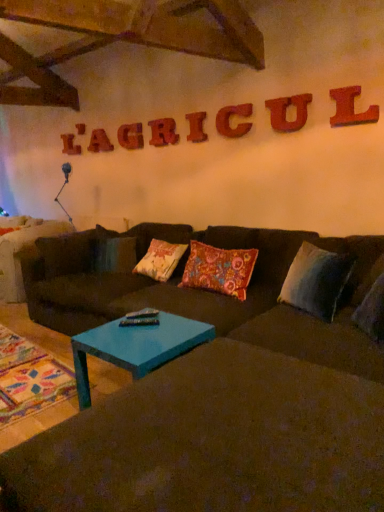
What is the approximate width of gray fabric pillow at right, which appears as the 2th pillow when viewed from the left?

gray fabric pillow at right, which appears as the 2th pillow when viewed from the left, is 9.56 inches wide.

Describe the element at coordinates (136, 347) in the screenshot. I see `teal glossy coffee table at center` at that location.

You are a GUI agent. You are given a task and a screenshot of the screen. Output one action in this format:
    pyautogui.click(x=<x>, y=<y>)
    Task: Click on the dark brown fabric couch at center
    This screenshot has width=384, height=512.
    Given the screenshot: What is the action you would take?
    pyautogui.click(x=212, y=390)

What are the coordinates of `gray fabric pillow at right, which appears as the 2th pillow when viewed from the left` in the screenshot? It's located at (316, 280).

From the image's perspective, is floral-patterned fabric pillow at center, which appears as the second pillow when viewed from the right, located above gray fabric pillow at right, which appears as the 2th pillow when viewed from the left?

Indeed, from the image's perspective, floral-patterned fabric pillow at center, which appears as the second pillow when viewed from the right, is shown above gray fabric pillow at right, which appears as the 2th pillow when viewed from the left.

From a real-world perspective, is floral-patterned fabric pillow at center, the 1th pillow when ordered from left to right, physically above gray fabric pillow at right, the first pillow when ordered from right to left?

Correct, in the physical world, floral-patterned fabric pillow at center, the 1th pillow when ordered from left to right, is higher than gray fabric pillow at right, the first pillow when ordered from right to left.

Is there a large distance between floral-patterned fabric pillow at center, the 1th pillow when ordered from left to right, and gray fabric pillow at right, which appears as the 2th pillow when viewed from the left?

Actually, floral-patterned fabric pillow at center, the 1th pillow when ordered from left to right, and gray fabric pillow at right, which appears as the 2th pillow when viewed from the left, are a little close together.

From the picture: Which object is further away from the camera taking this photo, floral-patterned fabric pillow at center, the 1th pillow when ordered from left to right, or gray fabric pillow at right, the first pillow when ordered from right to left?

floral-patterned fabric pillow at center, the 1th pillow when ordered from left to right, is more distant.

From the image's perspective, is gray fabric pillow at right, the first pillow when ordered from right to left, on top of floral-patterned fabric pillow at center, which appears as the second pillow when viewed from the right?

No, from the image's perspective, gray fabric pillow at right, the first pillow when ordered from right to left, is not on top of floral-patterned fabric pillow at center, which appears as the second pillow when viewed from the right.

Is point (288, 282) positioned before point (232, 258)?

Yes.

Does gray fabric pillow at right, which appears as the 2th pillow when viewed from the left, have a lesser height compared to floral-patterned fabric pillow at center, the 1th pillow when ordered from left to right?

Correct, gray fabric pillow at right, which appears as the 2th pillow when viewed from the left, is not as tall as floral-patterned fabric pillow at center, the 1th pillow when ordered from left to right.

Is dark brown fabric couch at center located within floral-patterned fabric pillow at center, which appears as the second pillow when viewed from the right?

No, dark brown fabric couch at center is not inside floral-patterned fabric pillow at center, which appears as the second pillow when viewed from the right.

Who is more distant, floral-patterned fabric pillow at center, the 1th pillow when ordered from left to right, or dark brown fabric couch at center?

floral-patterned fabric pillow at center, the 1th pillow when ordered from left to right, is behind.

Find the location of a particular element. This screenshot has width=384, height=512. studio couch in front of the floral-patterned fabric pillow at center, which appears as the second pillow when viewed from the right is located at coordinates (212, 390).

Is floral-patterned fabric pillow at center, the 1th pillow when ordered from left to right, thinner than dark brown fabric couch at center?

Indeed, floral-patterned fabric pillow at center, the 1th pillow when ordered from left to right, has a lesser width compared to dark brown fabric couch at center.

Which of these two, floral-patterned fabric pillow at center, the 1th pillow when ordered from left to right, or teal glossy coffee table at center, is smaller?

With smaller size is floral-patterned fabric pillow at center, the 1th pillow when ordered from left to right.

Between point (220, 269) and point (172, 317), which one is positioned behind?

The point (220, 269) is behind.

This screenshot has height=512, width=384. I want to click on coffee table below the floral-patterned fabric pillow at center, the 1th pillow when ordered from left to right (from the image's perspective), so click(x=136, y=347).

Does floral-patterned fabric pillow at center, which appears as the second pillow when viewed from the right, lie in front of teal glossy coffee table at center?

That is False.

Is floral-patterned fabric pillow at center, which appears as the second pillow when viewed from the right, at the back of teal glossy coffee table at center?

Yes, teal glossy coffee table at center is facing away from floral-patterned fabric pillow at center, which appears as the second pillow when viewed from the right.

Is teal glossy coffee table at center directly adjacent to floral-patterned fabric pillow at center, which appears as the second pillow when viewed from the right?

No.

Is teal glossy coffee table at center inside the boundaries of floral-patterned fabric pillow at center, the 1th pillow when ordered from left to right, or outside?

The correct answer is: outside.

From a real-world perspective, is teal glossy coffee table at center above or below floral-patterned fabric pillow at center, the 1th pillow when ordered from left to right?

teal glossy coffee table at center is below floral-patterned fabric pillow at center, the 1th pillow when ordered from left to right.

Between point (137, 345) and point (325, 383), which one is positioned in front?

The point (325, 383) is closer to the camera.

Are teal glossy coffee table at center and dark brown fabric couch at center far apart?

They are positioned close to each other.

From a real-world perspective, which is physically below, teal glossy coffee table at center or dark brown fabric couch at center?

teal glossy coffee table at center is physically lower.

In the scene shown: Considering the sizes of objects teal glossy coffee table at center and dark brown fabric couch at center in the image provided, who is bigger, teal glossy coffee table at center or dark brown fabric couch at center?

dark brown fabric couch at center.

Considering their positions, is gray fabric pillow at right, the first pillow when ordered from right to left, located in front of or behind teal glossy coffee table at center?

gray fabric pillow at right, the first pillow when ordered from right to left, is positioned farther from the viewer than teal glossy coffee table at center.

Image resolution: width=384 pixels, height=512 pixels. I want to click on coffee table located in front of the gray fabric pillow at right, the first pillow when ordered from right to left, so click(x=136, y=347).

Is point (326, 271) closer to camera compared to point (129, 336)?

No, it is behind (129, 336).

Locate an element on the screen. This screenshot has width=384, height=512. pillow lying behind the gray fabric pillow at right, the first pillow when ordered from right to left is located at coordinates (219, 269).

This screenshot has width=384, height=512. Find the location of `pillow in front of the floral-patterned fabric pillow at center, the 1th pillow when ordered from left to right`. pillow in front of the floral-patterned fabric pillow at center, the 1th pillow when ordered from left to right is located at coordinates (316, 280).

In the scene shown: From the image, which object appears to be farther from teal glossy coffee table at center, floral-patterned fabric pillow at center, the 1th pillow when ordered from left to right, or gray fabric pillow at right, which appears as the 2th pillow when viewed from the left?

gray fabric pillow at right, which appears as the 2th pillow when viewed from the left, is further to teal glossy coffee table at center.

Based on their spatial positions, is teal glossy coffee table at center or gray fabric pillow at right, which appears as the 2th pillow when viewed from the left, further from floral-patterned fabric pillow at center, which appears as the second pillow when viewed from the right?

Among the two, teal glossy coffee table at center is located further to floral-patterned fabric pillow at center, which appears as the second pillow when viewed from the right.

Considering their positions, is dark brown fabric couch at center positioned further to gray fabric pillow at right, which appears as the 2th pillow when viewed from the left, than teal glossy coffee table at center?

teal glossy coffee table at center is further to gray fabric pillow at right, which appears as the 2th pillow when viewed from the left.

Based on their spatial positions, is gray fabric pillow at right, the first pillow when ordered from right to left, or dark brown fabric couch at center closer to teal glossy coffee table at center?

dark brown fabric couch at center lies closer to teal glossy coffee table at center than the other object.

Considering their positions, is dark brown fabric couch at center positioned further to gray fabric pillow at right, the first pillow when ordered from right to left, than floral-patterned fabric pillow at center, the 1th pillow when ordered from left to right?

dark brown fabric couch at center.

Based on their spatial positions, is gray fabric pillow at right, which appears as the 2th pillow when viewed from the left, or floral-patterned fabric pillow at center, the 1th pillow when ordered from left to right, further from teal glossy coffee table at center?

Based on the image, gray fabric pillow at right, which appears as the 2th pillow when viewed from the left, appears to be further to teal glossy coffee table at center.

Estimate the real-world distances between objects in this image. Which object is further from floral-patterned fabric pillow at center, which appears as the second pillow when viewed from the right, gray fabric pillow at right, which appears as the 2th pillow when viewed from the left, or dark brown fabric couch at center?

dark brown fabric couch at center is further to floral-patterned fabric pillow at center, which appears as the second pillow when viewed from the right.

Looking at the image, which one is located closer to teal glossy coffee table at center, dark brown fabric couch at center or gray fabric pillow at right, the first pillow when ordered from right to left?

dark brown fabric couch at center lies closer to teal glossy coffee table at center than the other object.

Locate an element on the screen. The height and width of the screenshot is (512, 384). coffee table positioned between dark brown fabric couch at center and floral-patterned fabric pillow at center, the 1th pillow when ordered from left to right, from near to far is located at coordinates (136, 347).

You are a GUI agent. You are given a task and a screenshot of the screen. Output one action in this format:
    pyautogui.click(x=<x>, y=<y>)
    Task: Click on the coffee table between dark brown fabric couch at center and gray fabric pillow at right, which appears as the 2th pillow when viewed from the left, in the front-back direction
    
    Given the screenshot: What is the action you would take?
    pyautogui.click(x=136, y=347)

The height and width of the screenshot is (512, 384). I want to click on pillow positioned between dark brown fabric couch at center and floral-patterned fabric pillow at center, the 1th pillow when ordered from left to right, from near to far, so click(x=316, y=280).

You are a GUI agent. You are given a task and a screenshot of the screen. Output one action in this format:
    pyautogui.click(x=<x>, y=<y>)
    Task: Click on the pillow located between teal glossy coffee table at center and gray fabric pillow at right, which appears as the 2th pillow when viewed from the left, in the left-right direction
    
    Given the screenshot: What is the action you would take?
    pyautogui.click(x=219, y=269)